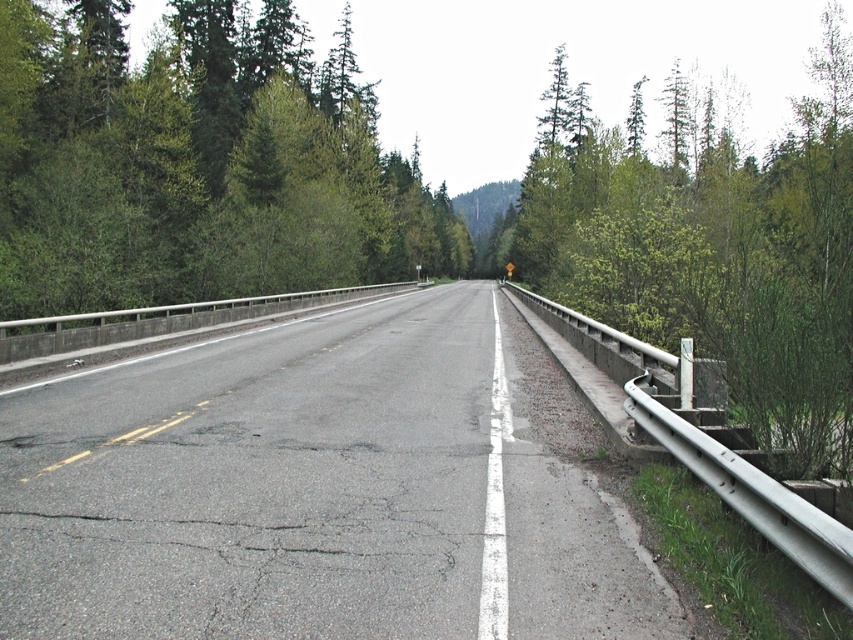
Question: Which object is farther from the camera taking this photo?

Choices:
 (A) asphalt road at center
 (B) green leafy shrub at right
 (C) green leafy trees at center

Answer: (C)

Question: Considering the relative positions of asphalt road at center and green leafy trees at center in the image provided, where is asphalt road at center located with respect to green leafy trees at center?

Choices:
 (A) left
 (B) right

Answer: (B)

Question: Considering the relative positions of asphalt road at center and green leafy shrub at right in the image provided, where is asphalt road at center located with respect to green leafy shrub at right?

Choices:
 (A) below
 (B) above

Answer: (A)

Question: Among these points, which one is farthest from the camera?

Choices:
 (A) (155, 120)
 (B) (833, 237)

Answer: (A)

Question: Which of the following is the farthest from the observer?

Choices:
 (A) (105, 572)
 (B) (825, 259)

Answer: (B)

Question: Does asphalt road at center have a smaller size compared to green leafy shrub at right?

Choices:
 (A) yes
 (B) no

Answer: (A)